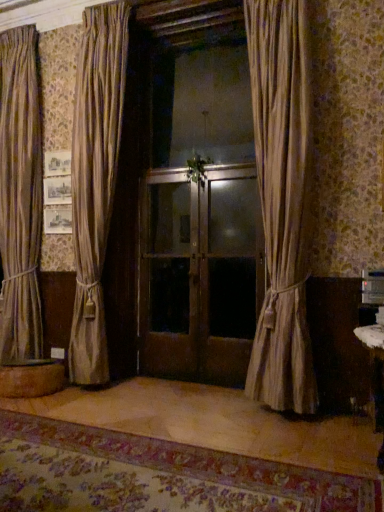
Question: Would you consider matte brown curtain at center, placed as the second curtain when sorted from front to back, to be distant from matte wooden screen door at center, acting as the first screen door starting from the right?

Choices:
 (A) yes
 (B) no

Answer: (A)

Question: Is matte brown curtain at center, positioned as the first curtain in back-to-front order, smaller than matte wooden screen door at center, the second screen door from the left?

Choices:
 (A) no
 (B) yes

Answer: (A)

Question: Is the depth of matte brown curtain at center, the first curtain from the left, less than that of matte wooden screen door at center, the second screen door from the left?

Choices:
 (A) yes
 (B) no

Answer: (A)

Question: From a real-world perspective, does matte brown curtain at center, placed as the second curtain when sorted from front to back, stand above matte wooden screen door at center, the second screen door from the left?

Choices:
 (A) no
 (B) yes

Answer: (B)

Question: From the image's perspective, is matte brown curtain at center, placed as the second curtain when sorted from front to back, under matte wooden screen door at center, the second screen door from the left?

Choices:
 (A) yes
 (B) no

Answer: (B)

Question: Would you say matte wooden screen door at center, the second screen door from the left, is inside or outside silky beige curtain at center, which is the second curtain in back-to-front order?

Choices:
 (A) outside
 (B) inside

Answer: (A)

Question: In the image, is matte wooden screen door at center, the second screen door from the left, positioned in front of or behind silky beige curtain at center, the 2th curtain in the left-to-right sequence?

Choices:
 (A) front
 (B) behind

Answer: (B)

Question: Is matte wooden screen door at center, acting as the first screen door starting from the right, bigger or smaller than silky beige curtain at center, which is the second curtain in back-to-front order?

Choices:
 (A) big
 (B) small

Answer: (B)

Question: Is point (220, 192) positioned closer to the camera than point (271, 160)?

Choices:
 (A) farther
 (B) closer

Answer: (A)

Question: Considering the positions of brown wooden screen door at center, the 2th screen door viewed from the right, and matte brown curtain at center, positioned as the first curtain in back-to-front order, in the image, is brown wooden screen door at center, the 2th screen door viewed from the right, bigger or smaller than matte brown curtain at center, positioned as the first curtain in back-to-front order,?

Choices:
 (A) big
 (B) small

Answer: (B)

Question: From the image's perspective, is brown wooden screen door at center, the 2th screen door viewed from the right, located above or below matte brown curtain at center, positioned as the first curtain in back-to-front order?

Choices:
 (A) above
 (B) below

Answer: (B)

Question: From a real-world perspective, is brown wooden screen door at center, the 1th screen door positioned from the left, above or below matte brown curtain at center, the first curtain from the left?

Choices:
 (A) below
 (B) above

Answer: (A)

Question: Considering the relative positions of brown wooden screen door at center, the 2th screen door viewed from the right, and matte brown curtain at center, positioned as the first curtain in back-to-front order, in the image provided, is brown wooden screen door at center, the 2th screen door viewed from the right, to the left or to the right of matte brown curtain at center, positioned as the first curtain in back-to-front order,?

Choices:
 (A) left
 (B) right

Answer: (B)

Question: From their relative heights in the image, would you say wooden round table at lower left is taller or shorter than silky beige curtain at center, the 2th curtain in the left-to-right sequence?

Choices:
 (A) tall
 (B) short

Answer: (B)

Question: Choose the correct answer: Is wooden round table at lower left inside silky beige curtain at center, marked as the 1th curtain in a right-to-left arrangement, or outside it?

Choices:
 (A) outside
 (B) inside

Answer: (A)